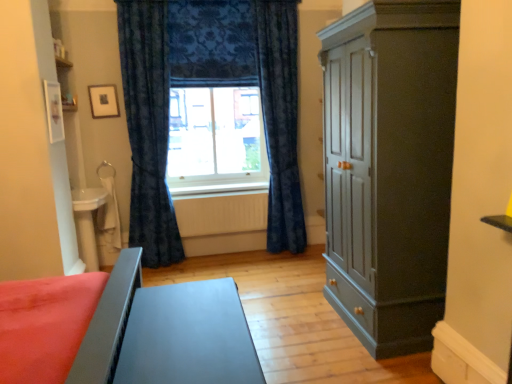
Question: From a real-world perspective, is wooden picture frame at upper left physically below matte gray table at lower left, positioned as the 1th table in left-to-right order?

Choices:
 (A) yes
 (B) no

Answer: (B)

Question: Does wooden picture frame at upper left appear on the left side of matte gray table at lower left, acting as the 2th table starting from the front?

Choices:
 (A) no
 (B) yes

Answer: (A)

Question: Is wooden picture frame at upper left bigger than matte gray table at lower left, acting as the 2th table starting from the front?

Choices:
 (A) no
 (B) yes

Answer: (A)

Question: Considering the relative positions of wooden picture frame at upper left and matte gray table at lower left, arranged as the 1th table when viewed from the back, in the image provided, is wooden picture frame at upper left to the right of matte gray table at lower left, arranged as the 1th table when viewed from the back, from the viewer's perspective?

Choices:
 (A) no
 (B) yes

Answer: (B)

Question: Does wooden picture frame at upper left have a lesser height compared to matte gray table at lower left, arranged as the 1th table when viewed from the back?

Choices:
 (A) yes
 (B) no

Answer: (A)

Question: In terms of height, does wooden picture frame at upper left look taller or shorter compared to velvet dark blue curtain at center, which is the first curtain in right-to-left order?

Choices:
 (A) tall
 (B) short

Answer: (B)

Question: Is point (117, 112) closer or farther from the camera than point (274, 205)?

Choices:
 (A) farther
 (B) closer

Answer: (B)

Question: Considering the relative positions of wooden picture frame at upper left and velvet dark blue curtain at center, which is the first curtain in right-to-left order, in the image provided, is wooden picture frame at upper left to the left or to the right of velvet dark blue curtain at center, which is the first curtain in right-to-left order,?

Choices:
 (A) left
 (B) right

Answer: (A)

Question: From a real-world perspective, is wooden picture frame at upper left positioned above or below velvet dark blue curtain at center, which is the first curtain in right-to-left order?

Choices:
 (A) below
 (B) above

Answer: (B)

Question: Considering the positions of wooden picture frame at upper left and velvet dark blue curtain at center, the 1th curtain from the left, in the image, is wooden picture frame at upper left bigger or smaller than velvet dark blue curtain at center, the 1th curtain from the left,?

Choices:
 (A) small
 (B) big

Answer: (A)

Question: Is point (114, 97) closer or farther from the camera than point (133, 137)?

Choices:
 (A) farther
 (B) closer

Answer: (B)

Question: Which is correct: wooden picture frame at upper left is inside velvet dark blue curtain at center, the 1th curtain from the left, or outside of it?

Choices:
 (A) inside
 (B) outside

Answer: (B)

Question: In the image, is wooden picture frame at upper left positioned in front of or behind velvet dark blue curtain at center, the 1th curtain from the left?

Choices:
 (A) front
 (B) behind

Answer: (B)

Question: Is point (103, 107) closer or farther from the camera than point (187, 130)?

Choices:
 (A) farther
 (B) closer

Answer: (B)

Question: From the image's perspective, is wooden picture frame at upper left located above or below velvet blue curtain at center?

Choices:
 (A) below
 (B) above

Answer: (A)